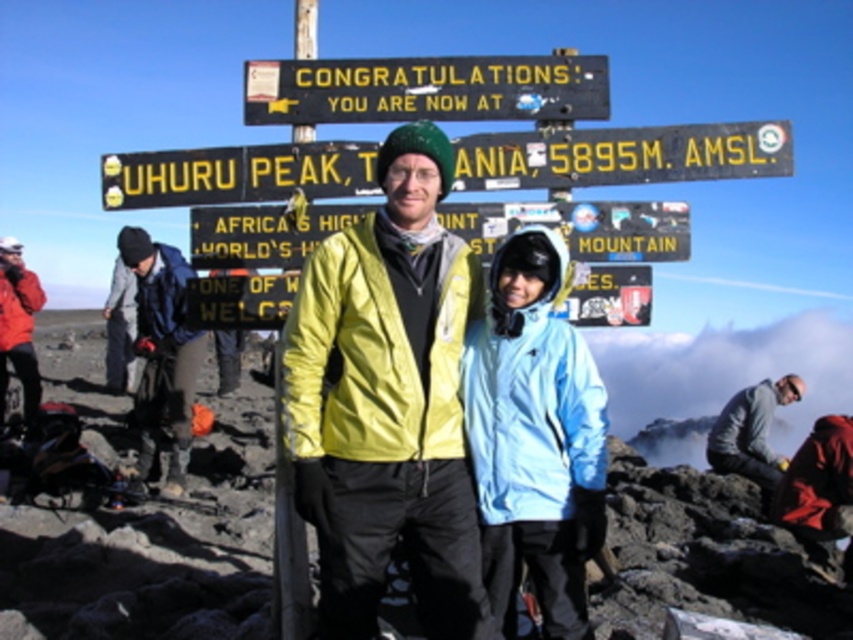
You are a photographer at Uhuru Peak and want to capture a photo of the gray fabric jacket at lower right without the black plastic sign at center blocking the view. Is this possible based on their positions?

The black plastic sign at center is located above the gray fabric jacket at lower right, so if you position yourself below the jacket or adjust the angle to avoid the sign above, you can capture the jacket without the sign blocking the view.

You are a photographer trying to capture the black plastic sign at center from a specific angle. If you move your camera to the left, will the sign move to the right in your view? Please explain using the coordinates provided in the description.

Yes, moving the camera to the left would cause the black plastic sign at center to appear to shift to the right in your view. This is due to the principle of parallax, where objects in the scene shift position relative to the camera when the camera position changes. Since the sign is located at coordinates approximately 0.244 on the x and 0.730 on the y axis, moving left would create this visual shift.